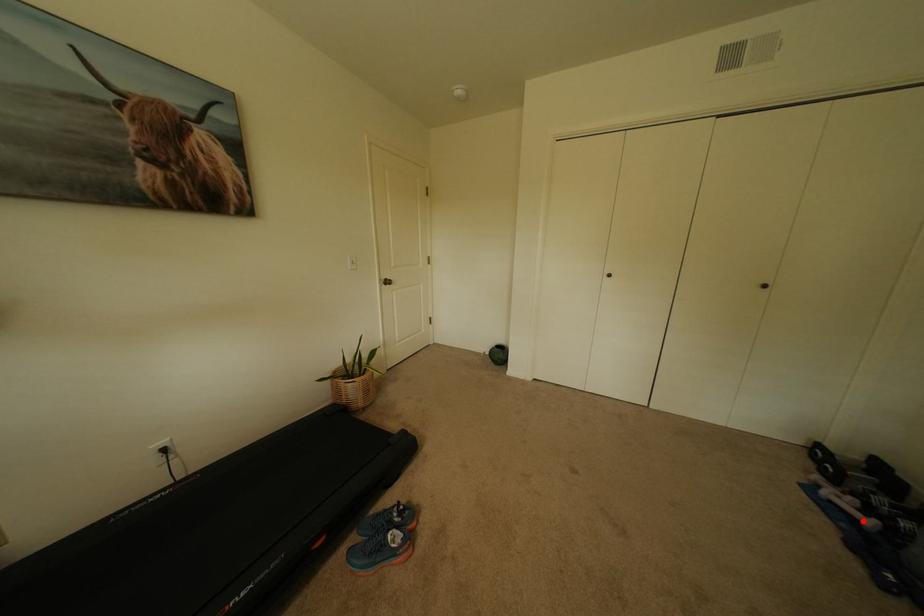
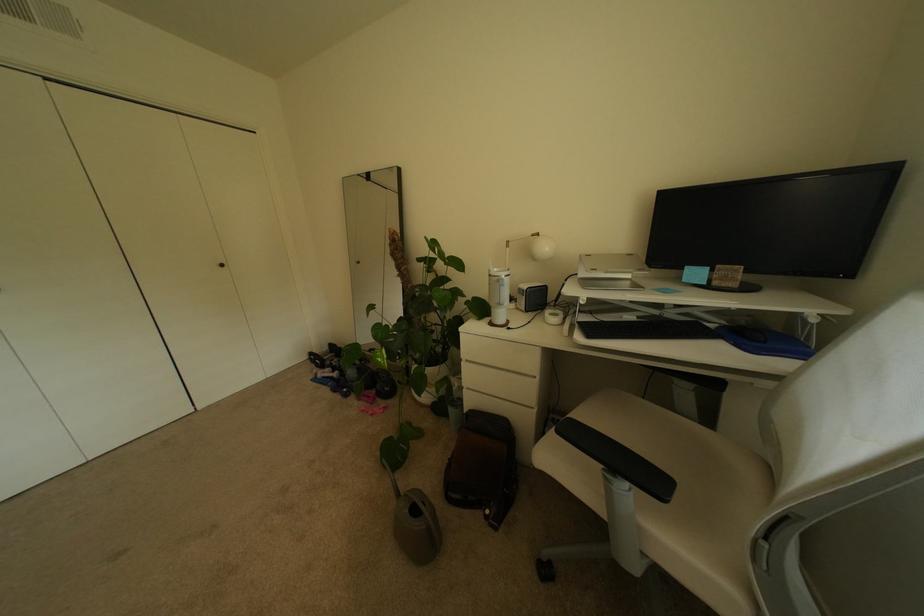
Question: I am providing you with two images of the same scene from different viewpoints. A red point is shown in image1. For the corresponding object point in image2, is it positioned nearer or farther from the camera?

Choices:
 (A) Nearer
 (B) Farther

Answer: (B)